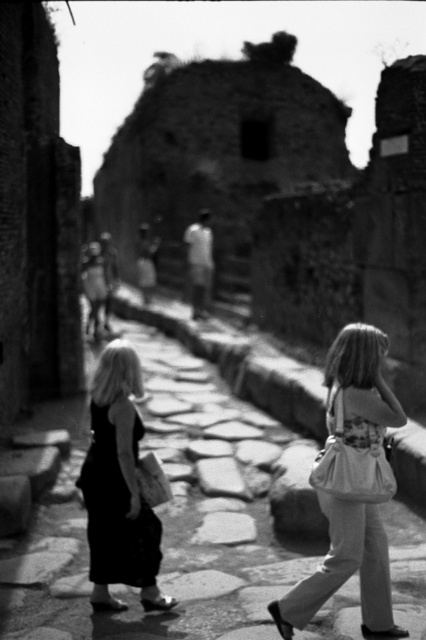
Who is lower down, pebble stone pavement at center or matte white purse at right?

matte white purse at right is lower down.

Is pebble stone pavement at center positioned before matte white purse at right?

No.

Find the location of a particular element. pebble stone pavement at center is located at coordinates (169, 512).

Who is more distant from viewer, (193, 611) or (127, 461)?

Positioned behind is point (193, 611).

Is pebble stone pavement at center to the left of matte black dress at center from the viewer's perspective?

Incorrect, pebble stone pavement at center is not on the left side of matte black dress at center.

Is point (62, 524) in front of point (121, 547)?

No, it is not.

Where is `pebble stone pavement at center`? The image size is (426, 640). pebble stone pavement at center is located at coordinates (169, 512).

Who is shorter, matte white purse at right or matte black dress at center?

With less height is matte black dress at center.

The height and width of the screenshot is (640, 426). Describe the element at coordinates (351, 486) in the screenshot. I see `matte white purse at right` at that location.

This screenshot has height=640, width=426. I want to click on matte white purse at right, so click(x=351, y=486).